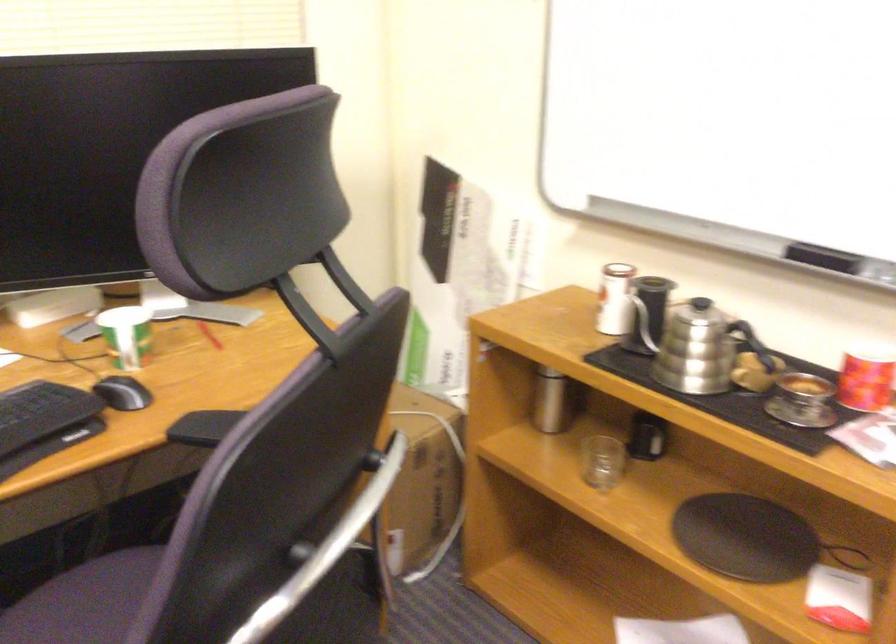
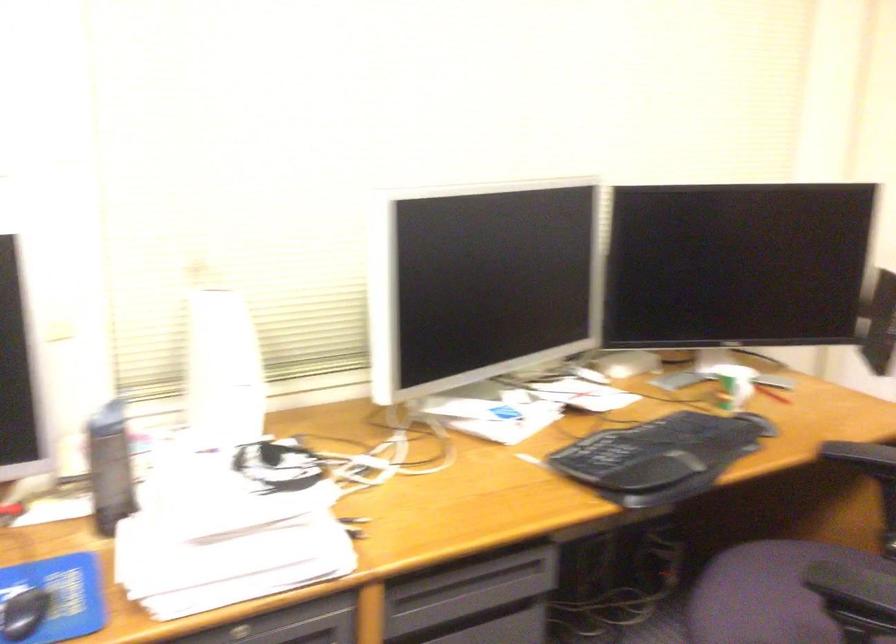
Question: The camera is either moving clockwise (left) or counter-clockwise (right) around the object. The first image is from the beginning of the video and the second image is from the end. Is the camera moving left or right when shooting the video?

Choices:
 (A) Left
 (B) Right

Answer: (B)